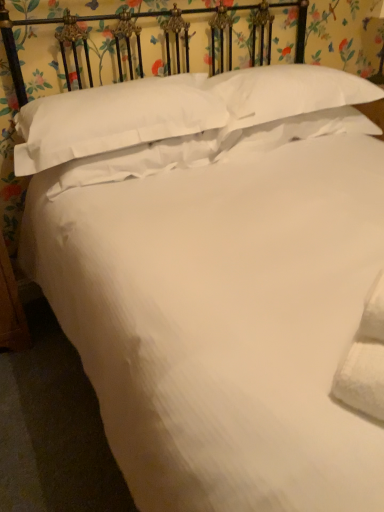
Question: Is white soft pillow at center, which ranks as the second pillow in left-to-right order, taller or shorter than white soft pillow at upper center, positioned as the 1th pillow in right-to-left order?

Choices:
 (A) tall
 (B) short

Answer: (B)

Question: In the image, is white soft pillow at center, which is the 3th pillow in right-to-left order, on the left side or the right side of white soft pillow at upper center, the 4th pillow when ordered from left to right?

Choices:
 (A) right
 (B) left

Answer: (B)

Question: Which object is positioned closest to the white cotton pillow at upper center, which is counted as the 4th pillow, starting from the right?

Choices:
 (A) white soft pillow at center, which ranks as the second pillow in left-to-right order
 (B) white soft pillow at upper center, the 4th pillow when ordered from left to right
 (C) white soft pillow at upper center, which is the second pillow in right-to-left order

Answer: (A)

Question: Considering the real-world distances, which object is farthest from the white soft pillow at upper center, positioned as the 1th pillow in right-to-left order?

Choices:
 (A) white soft pillow at upper center, which is the second pillow in right-to-left order
 (B) white soft pillow at center, which is the 3th pillow in right-to-left order
 (C) white cotton pillow at upper center, which is counted as the 4th pillow, starting from the right

Answer: (C)